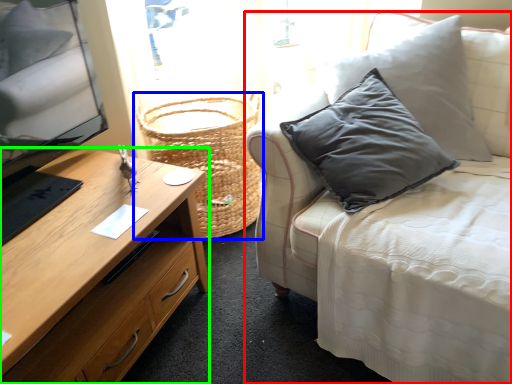
Question: Based on their relative distances, which object is nearer to studio couch (highlighted by a red box)? Choose from basket (highlighted by a blue box) and desk (highlighted by a green box).

Choices:
 (A) basket
 (B) desk

Answer: (B)